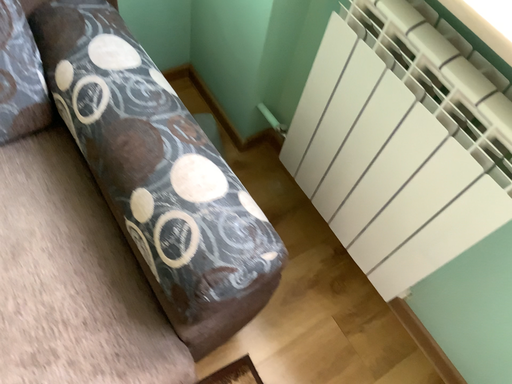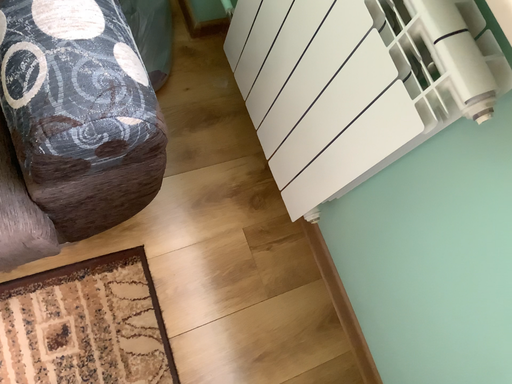
Question: How did the camera likely rotate when shooting the video?

Choices:
 (A) rotated upward
 (B) rotated downward

Answer: (B)